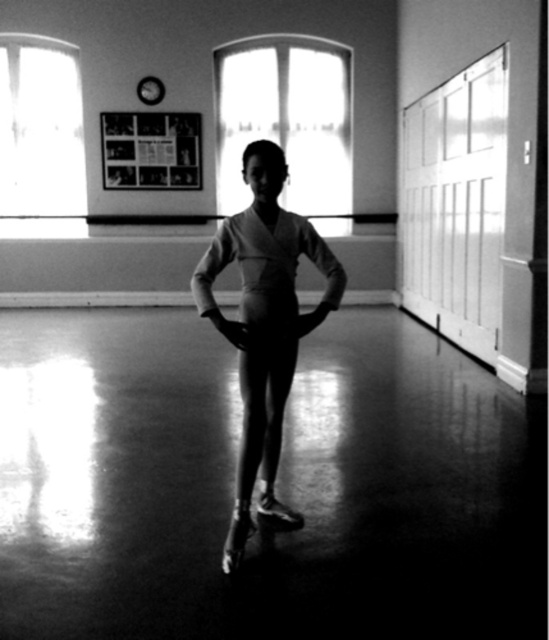
Question: Can you confirm if matte white leotard at center is wider than smooth fabric tights at center?

Choices:
 (A) no
 (B) yes

Answer: (B)

Question: Does matte white leotard at center appear on the right side of smooth fabric tights at center?

Choices:
 (A) no
 (B) yes

Answer: (B)

Question: Among these points, which one is farthest from the camera?

Choices:
 (A) (240, 474)
 (B) (271, 432)

Answer: (B)

Question: Is matte white leotard at center behind smooth fabric tights at center?

Choices:
 (A) yes
 (B) no

Answer: (B)